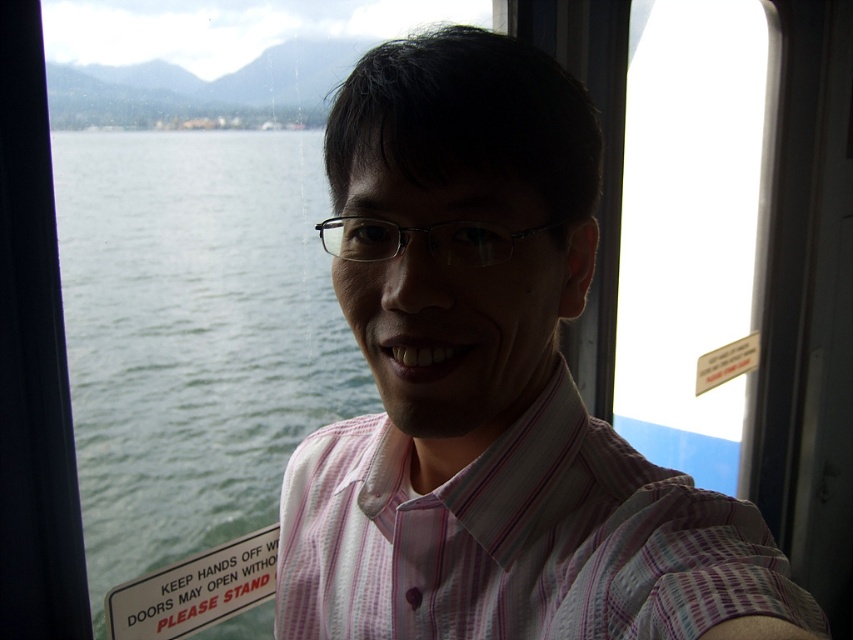
Based on the coordinates provided, which object in the scene is located at point (491,388)?

The point at (491,388) marks the pink striped shirt at center.

The person in the image is wearing a pink striped shirt at center and a pink striped dress shirt at center. Which one has a narrower width?

The pink striped shirt at center is thinner than the pink striped dress shirt at center, so the pink striped shirt at center has a narrower width.